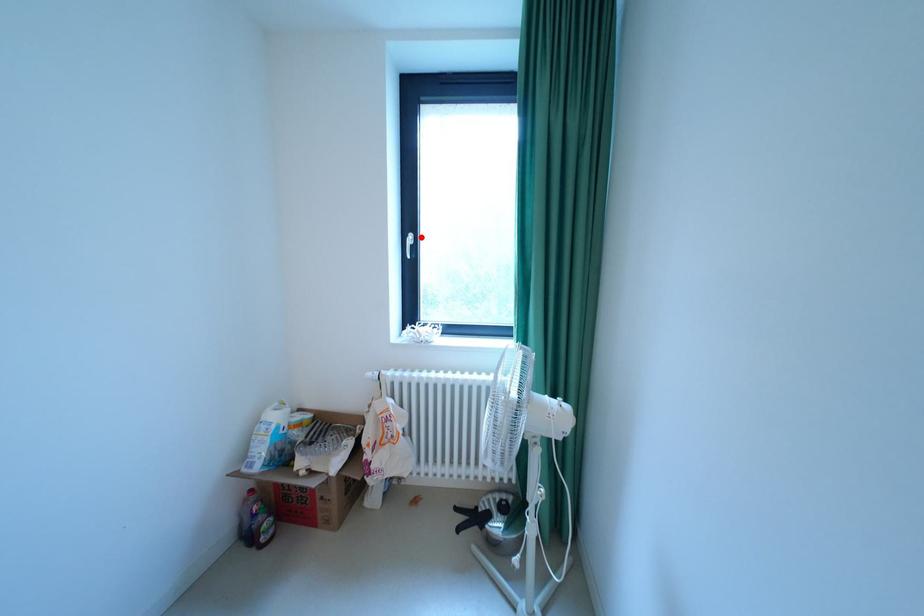
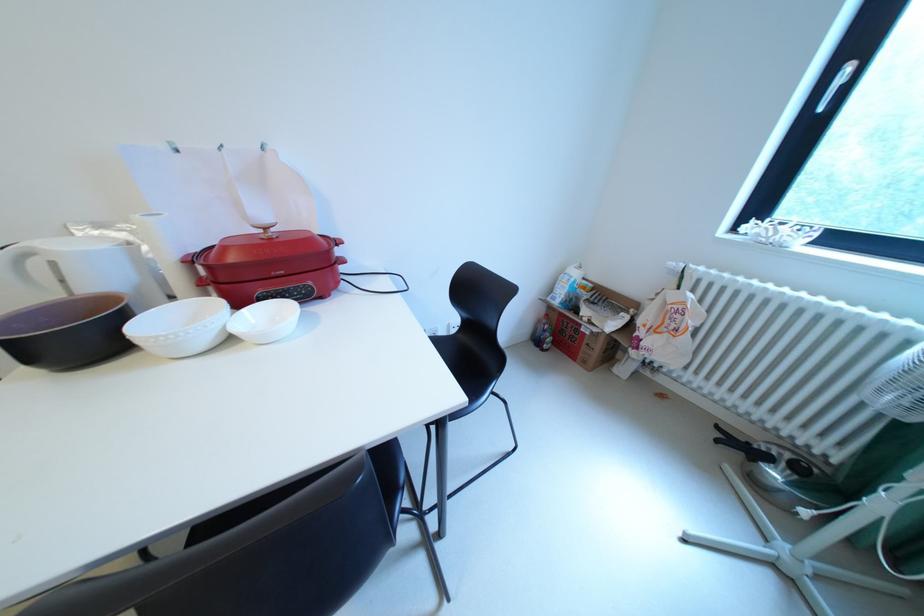
In the second image, find the point that corresponds to the highlighted location in the first image.

(859, 70)